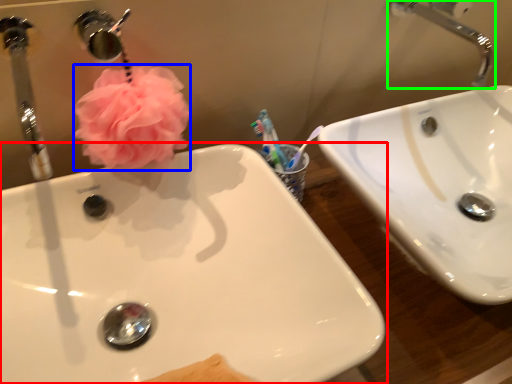
Question: Considering the real-world distances, which object is farthest from sink (highlighted by a red box)? flower (highlighted by a blue box) or tap (highlighted by a green box)?

Choices:
 (A) flower
 (B) tap

Answer: (B)